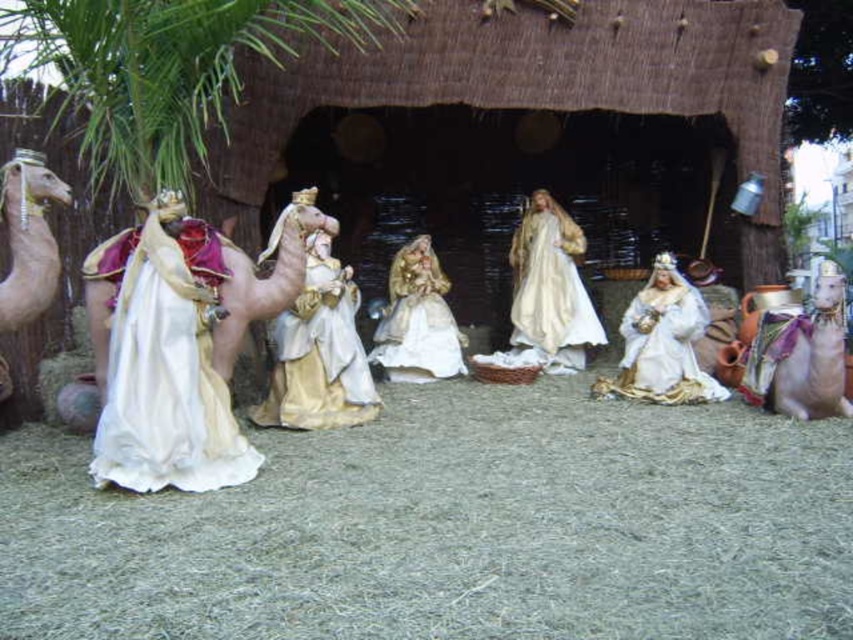
Question: Based on their relative distances, which object is nearer to the gold satin robe at center?

Choices:
 (A) smooth beige camel at lower right
 (B) gold satin dress at center

Answer: (B)

Question: Does white satin dress at left have a smaller size compared to beige fabric camel at left?

Choices:
 (A) no
 (B) yes

Answer: (A)

Question: Is smooth beige camel at lower right thinner than beige fabric camel at left?

Choices:
 (A) no
 (B) yes

Answer: (A)

Question: Does green leafy palm tree at upper left appear over white satin robe at center?

Choices:
 (A) no
 (B) yes

Answer: (B)

Question: Which object is farther from the camera taking this photo?

Choices:
 (A) gold satin robe at center
 (B) white satin dress at left
 (C) white satin robe at center
 (D) gold satin dress at center

Answer: (C)

Question: Among these points, which one is nearest to the camera?

Choices:
 (A) (62, 45)
 (B) (16, 188)

Answer: (B)